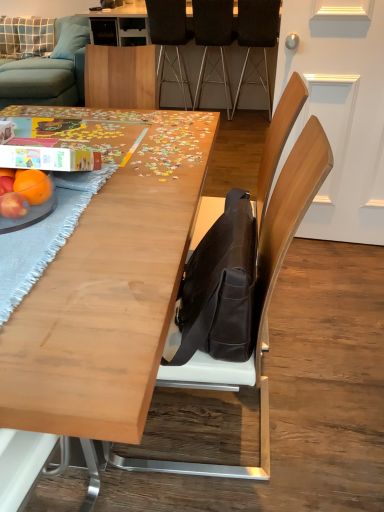
Find the location of `vacant point above light wood table at center, placed as the second table when sorted from top to bottom (from a real-world perspective)`. vacant point above light wood table at center, placed as the second table when sorted from top to bottom (from a real-world perspective) is located at coordinates (102, 186).